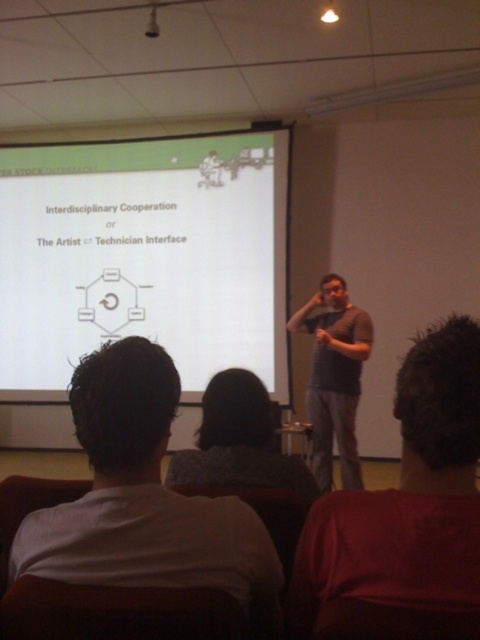
Is point (244, 561) closer to viewer compared to point (229, 406)?

Yes, point (244, 561) is in front of point (229, 406).

Does white shirt at lower left have a smaller size compared to gray knitted sweater at center?

Indeed, white shirt at lower left has a smaller size compared to gray knitted sweater at center.

Where is `white shirt at lower left`? This screenshot has height=640, width=480. white shirt at lower left is located at coordinates (144, 499).

Does gray knitted sweater at center lie behind dark gray t-shirt at center?

No, gray knitted sweater at center is closer to the viewer.

Measure the distance between gray knitted sweater at center and camera.

4.63 feet

Locate an element on the screen. The height and width of the screenshot is (640, 480). gray knitted sweater at center is located at coordinates (239, 442).

Who is taller, dark brown hair at lower right or dark gray t-shirt at center?

dark gray t-shirt at center

Does point (470, 605) come farther from viewer compared to point (322, 321)?

No, (470, 605) is in front of (322, 321).

Identify the location of dark brown hair at lower right. The height and width of the screenshot is (640, 480). (406, 509).